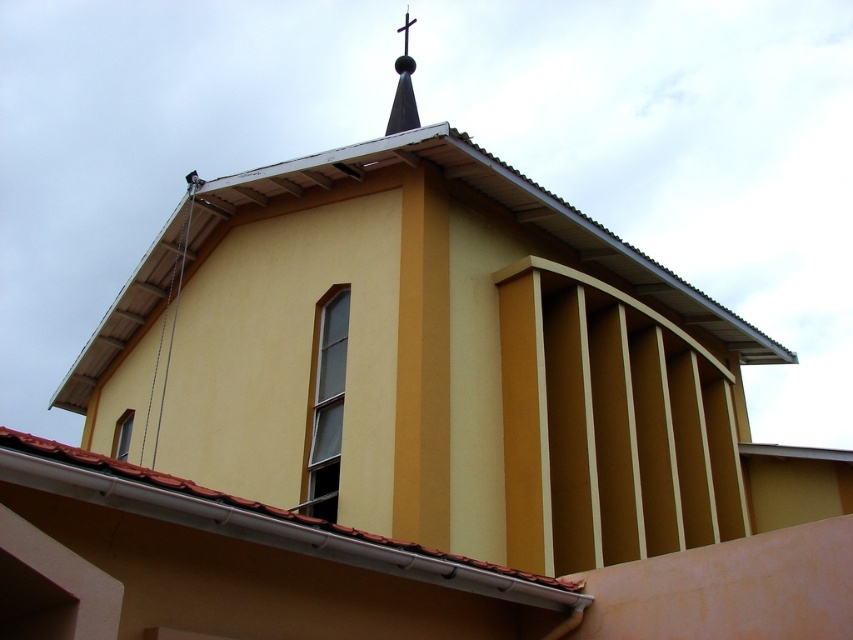
Does brown tile roof at lower left have a lesser width compared to glossy metal spire at upper center?

No, brown tile roof at lower left is not thinner than glossy metal spire at upper center.

Locate an element on the screen. The height and width of the screenshot is (640, 853). brown tile roof at lower left is located at coordinates (262, 522).

Is point (56, 468) less distant than point (403, 120)?

Yes.

At what (x,y) coordinates should I click in order to perform the action: click on brown tile roof at lower left. Please return your answer as a coordinate pair (x, y). Looking at the image, I should click on (262, 522).

This screenshot has width=853, height=640. Identify the location of brown tile roof at lower left. (262, 522).

Between brown tile roof at lower left and metallic cross at upper center, which one is positioned higher?

metallic cross at upper center is above.

Is point (538, 600) closer to viewer compared to point (403, 20)?

That is True.

Where is `brown tile roof at lower left`? This screenshot has height=640, width=853. brown tile roof at lower left is located at coordinates (262, 522).

Who is positioned more to the left, metallic gray roof at upper center or brown tile roof at lower left?

brown tile roof at lower left is more to the left.

Locate an element on the screen. metallic gray roof at upper center is located at coordinates (368, 188).

I want to click on metallic gray roof at upper center, so click(x=368, y=188).

Identify the location of metallic gray roof at upper center. Image resolution: width=853 pixels, height=640 pixels. (368, 188).